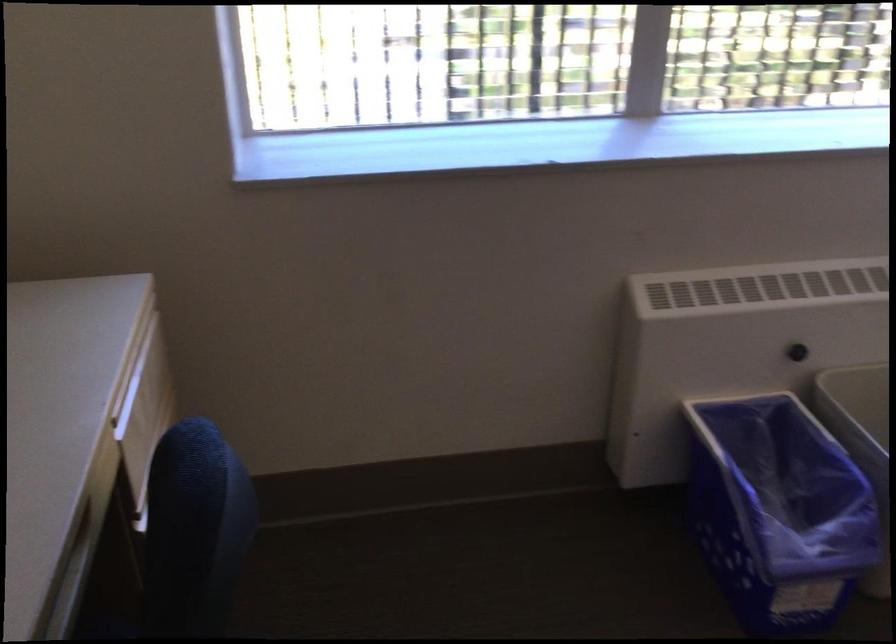
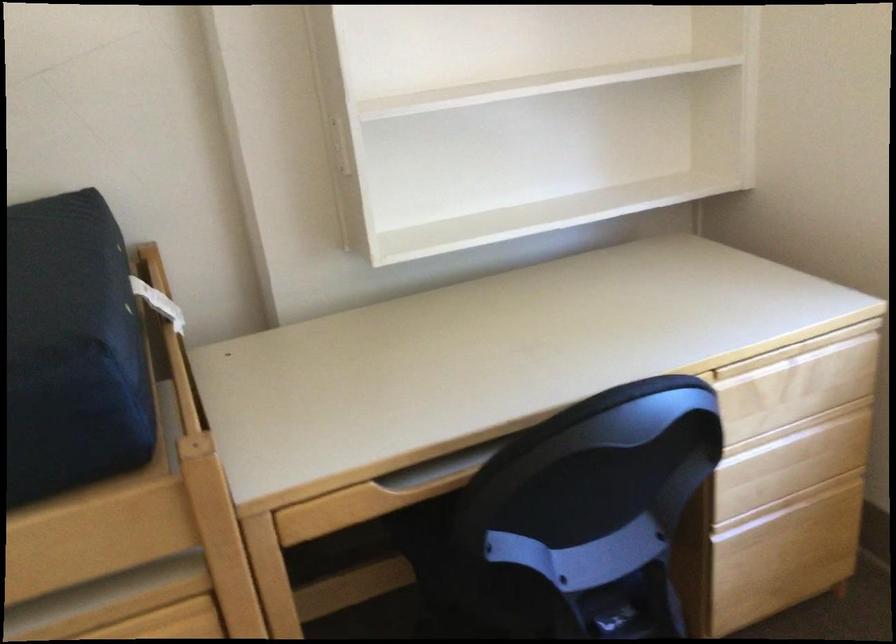
From the picture: Based on the continuous images, in which direction is the camera rotating?

The rotation direction of the camera is left-down.